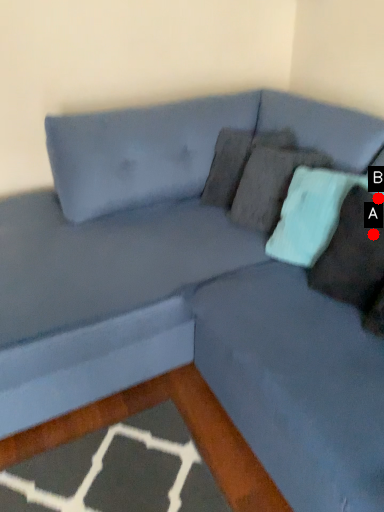
Question: Two points are circled on the image, labeled by A and B beside each circle. Which point is farther to the camera?

Choices:
 (A) A is further
 (B) B is further

Answer: (B)